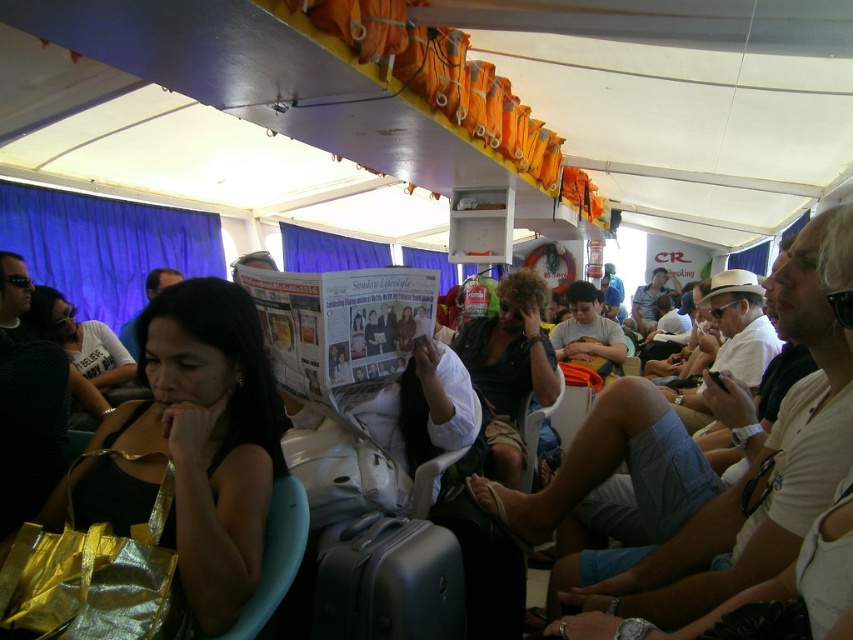
Question: Which point is closer to the camera?

Choices:
 (A) shiny gold bag at center
 (B) dark brown leather jacket at center

Answer: (A)

Question: Is shiny gold bag at center to the left of dark brown leather jacket at center from the viewer's perspective?

Choices:
 (A) yes
 (B) no

Answer: (A)

Question: Does shiny gold bag at center have a greater width compared to dark brown leather jacket at center?

Choices:
 (A) no
 (B) yes

Answer: (B)

Question: Can you confirm if shiny gold bag at center is thinner than dark brown leather jacket at center?

Choices:
 (A) yes
 (B) no

Answer: (B)